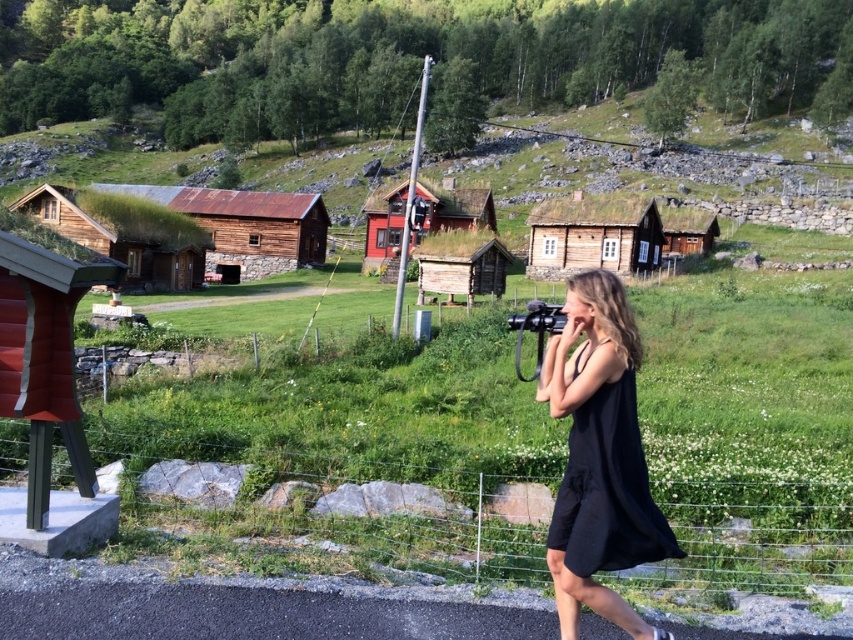
Question: Which object is the farthest from the wire mesh fence at lower center?

Choices:
 (A) brown thatched roof hut at center-left
 (B) red wooden hut at center
 (C) rusty wood hut at center
 (D) black matte dress at center

Answer: (C)

Question: Is red wooden hut at center above wooden log cabin at center?

Choices:
 (A) no
 (B) yes

Answer: (B)

Question: Does brown thatched roof hut at center-left have a greater width compared to wooden log cabin at center?

Choices:
 (A) no
 (B) yes

Answer: (B)

Question: Is black matte dress at center positioned before wooden thatched hut at center?

Choices:
 (A) no
 (B) yes

Answer: (B)

Question: Which point appears farthest from the camera in this image?

Choices:
 (A) (390, 230)
 (B) (210, 216)
 (C) (642, 513)

Answer: (A)

Question: Which point is farther to the camera?

Choices:
 (A) (122, 285)
 (B) (589, 262)

Answer: (B)